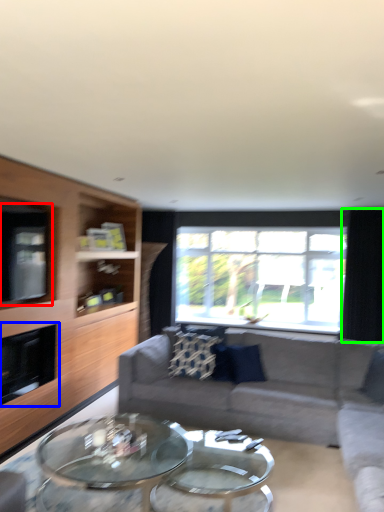
Question: Estimate the real-world distances between objects in this image. Which object is closer to window screen (highlighted by a red box), fireplace (highlighted by a blue box) or curtain (highlighted by a green box)?

Choices:
 (A) fireplace
 (B) curtain

Answer: (A)